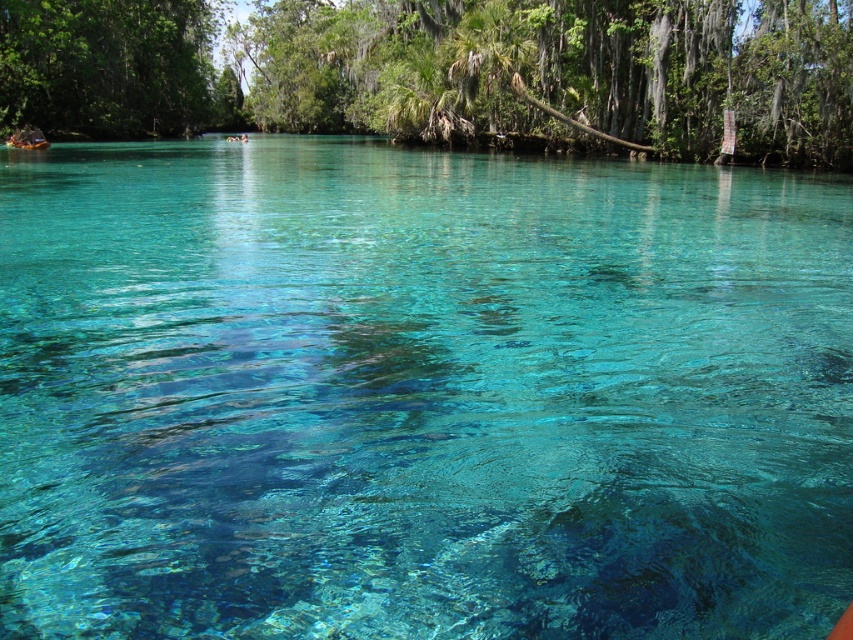
This screenshot has height=640, width=853. Describe the element at coordinates (445, 72) in the screenshot. I see `green leafy tree at upper center` at that location.

Can you confirm if green leafy tree at upper center is smaller than green leafy tree at upper left?

No, green leafy tree at upper center is not smaller than green leafy tree at upper left.

You are a GUI agent. You are given a task and a screenshot of the screen. Output one action in this format:
    pyautogui.click(x=<x>, y=<y>)
    Task: Click on the green leafy tree at upper center
    The image size is (853, 640).
    Given the screenshot: What is the action you would take?
    pyautogui.click(x=445, y=72)